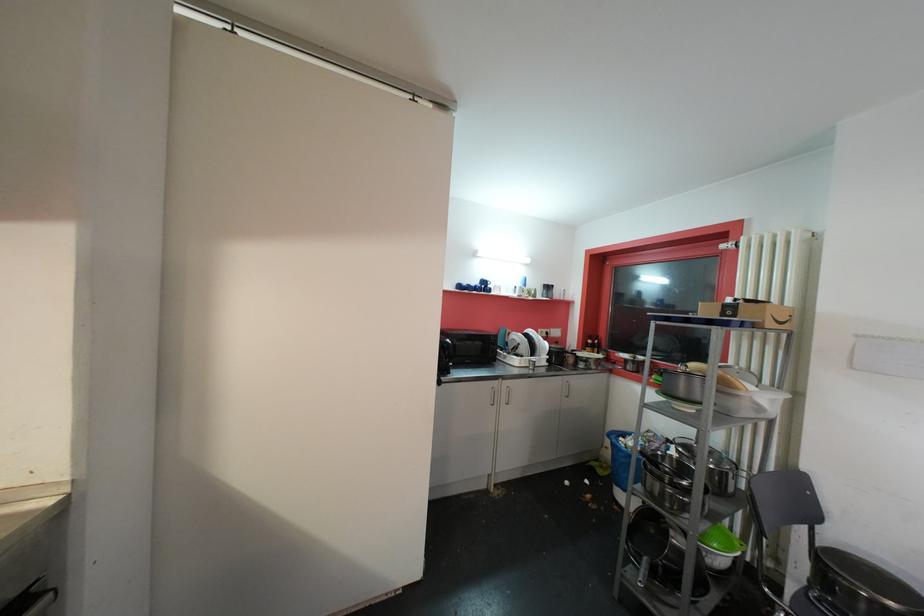
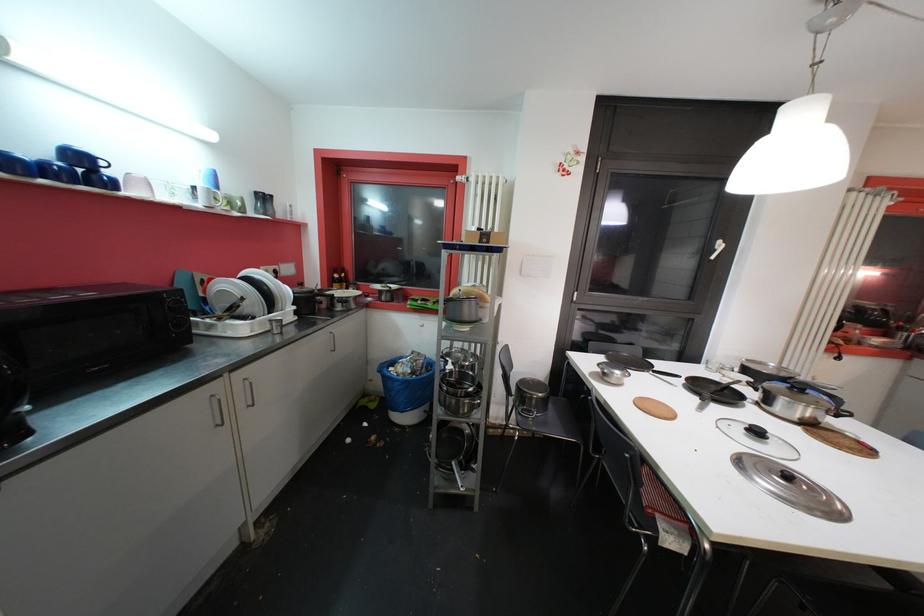
The images are taken continuously from a first-person perspective. In which direction is your viewpoint rotating?

The rotation direction of the camera is right-down.